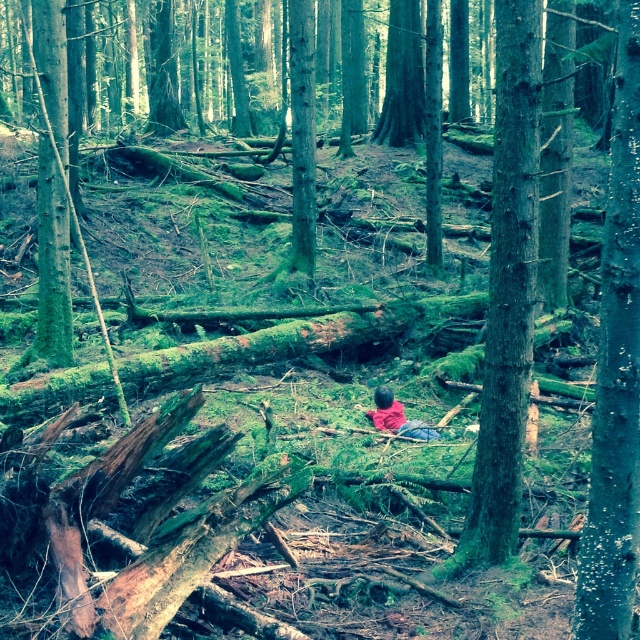
Does green mossy log at center have a greater width compared to green mossy tree at left?

No, green mossy log at center is not wider than green mossy tree at left.

Consider the image. Can you confirm if green mossy log at center is taller than green mossy tree at left?

In fact, green mossy log at center may be shorter than green mossy tree at left.

Does point (611, 384) lie in front of point (51, 202)?

Yes, point (611, 384) is in front of point (51, 202).

Locate an element on the screen. green mossy log at center is located at coordinates (616, 372).

Can you confirm if green rough bark tree at center is positioned to the right of red fabric child at center?

Indeed, green rough bark tree at center is positioned on the right side of red fabric child at center.

You are a GUI agent. You are given a task and a screenshot of the screen. Output one action in this format:
    pyautogui.click(x=<x>, y=<y>)
    Task: Click on the green rough bark tree at center
    This screenshot has width=640, height=640.
    Given the screenshot: What is the action you would take?
    pyautogui.click(x=506, y=292)

Does green rough bark tree at center have a smaller size compared to green mossy tree at left?

Indeed, green rough bark tree at center has a smaller size compared to green mossy tree at left.

Does point (518, 61) come in front of point (42, 216)?

Yes, point (518, 61) is closer to viewer.

This screenshot has height=640, width=640. Find the location of `green rough bark tree at center`. green rough bark tree at center is located at coordinates (506, 292).